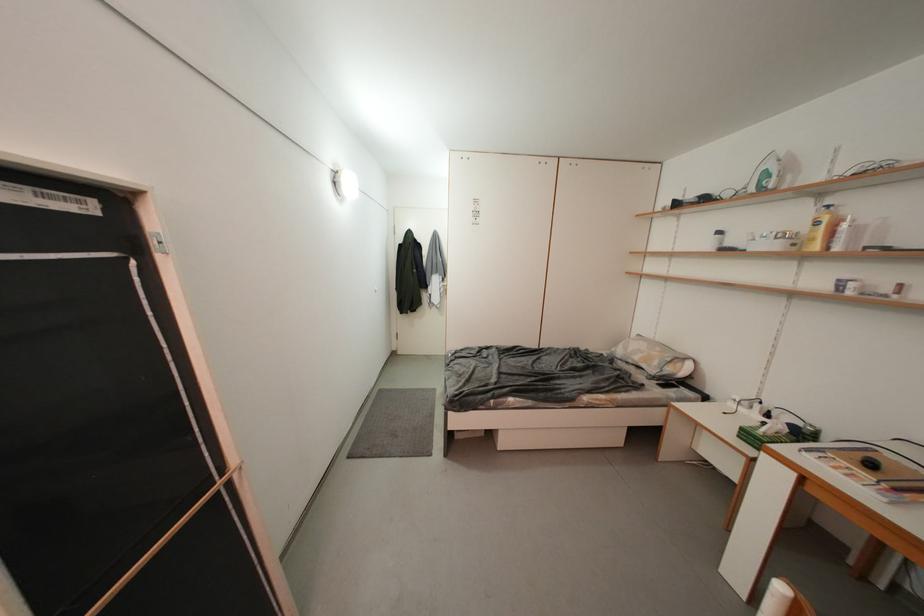
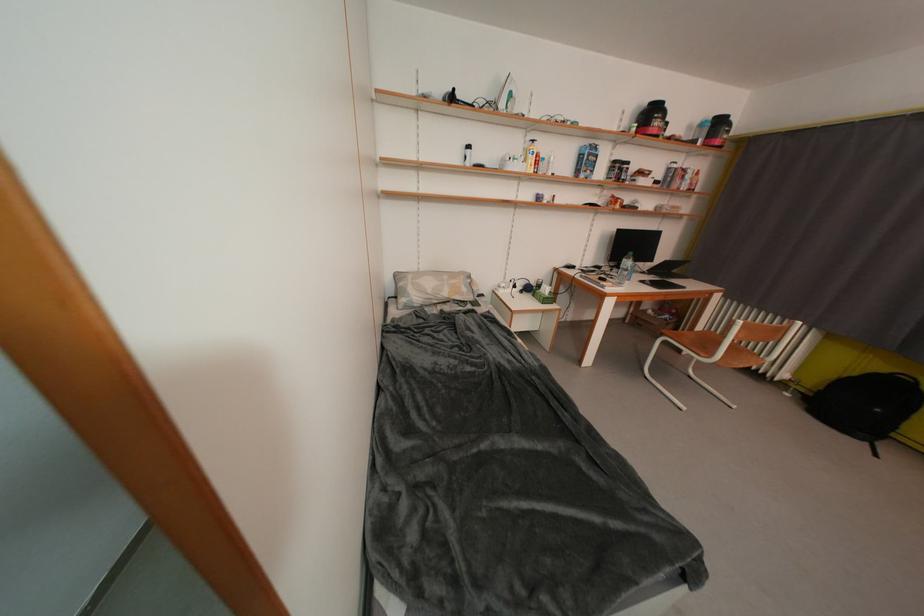
Locate, in the second image, the point that corresponds to the point at 663,367 in the first image.

(471, 293)